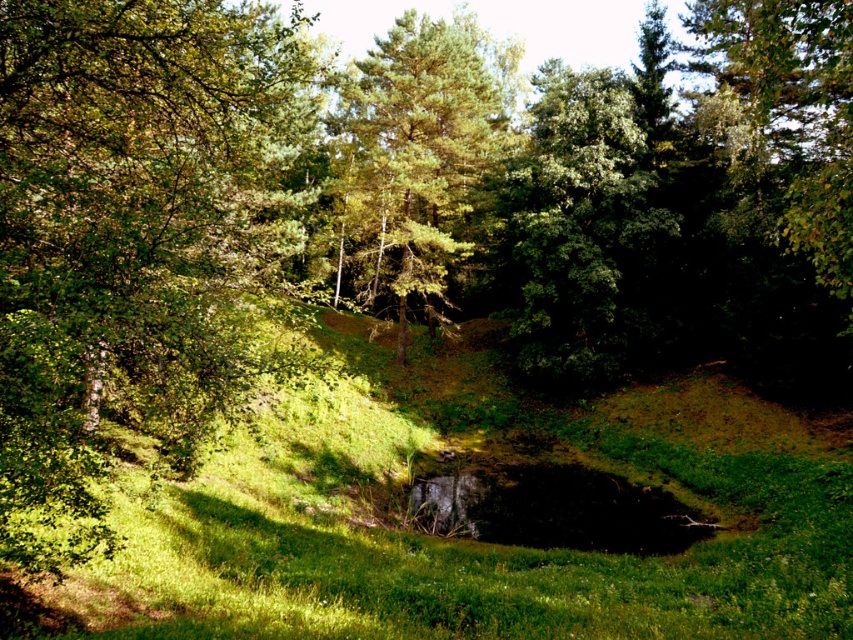
You are standing at the point labeled point at (610,611). You want to walk to a point that is exactly halfway between your current position and the edge of the pond. How far will you have to walk?

The distance between your current position at point at (610,611) and the edge of the pond is 45.29 feet. To find the halfway point, you would divide this distance by 2, so you would need to walk 22.645 feet.

You are standing on the green grass at center and want to reach the green leafy tree at left. Which direction should you move to get closer to the tree?

To reach the green leafy tree at left from the green grass at center, you should move upward since the green grass at center is located below the green leafy tree at left.